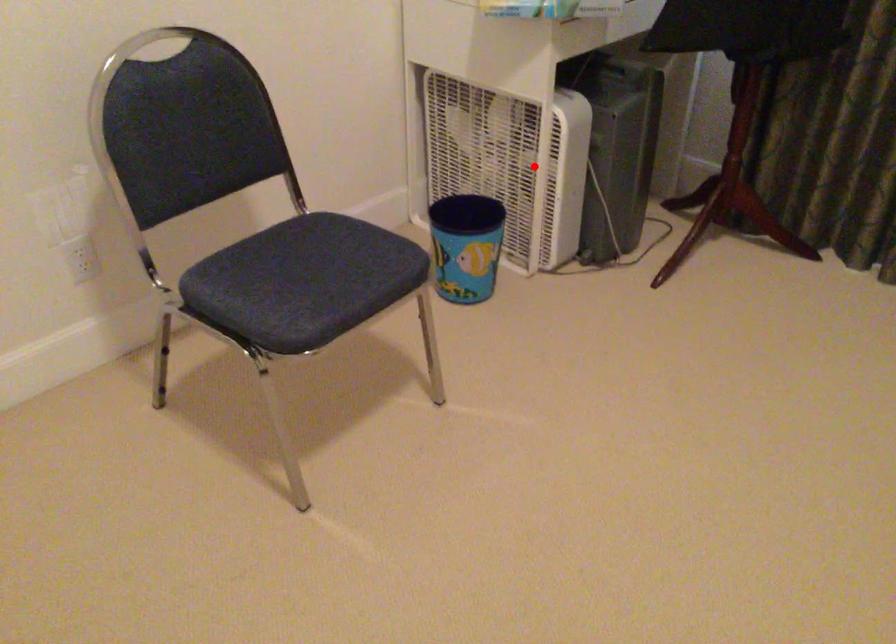
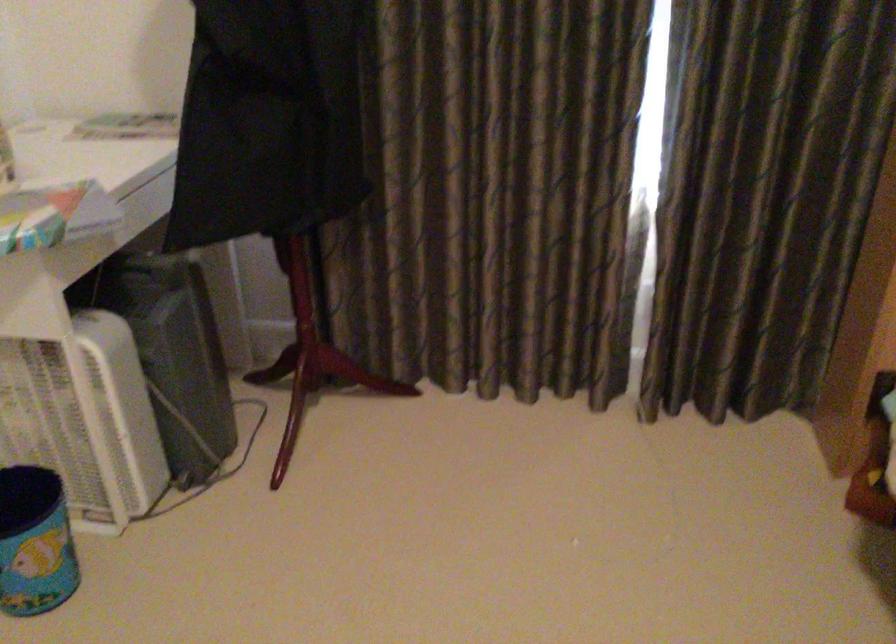
Question: I am providing you with two images of the same scene from different viewpoints. A red point is shown in image1. For the corresponding object point in image2, is it positioned nearer or farther from the camera?

Choices:
 (A) Nearer
 (B) Farther

Answer: (A)